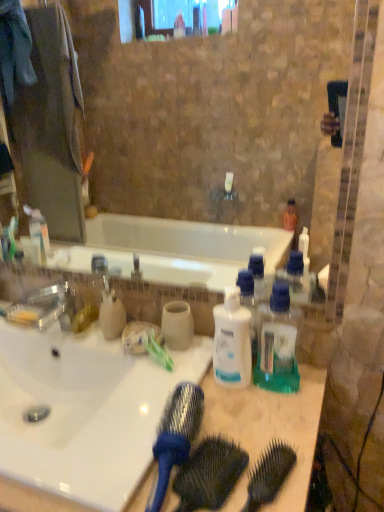
I want to click on vacant space in between blue plastic brush at center, which is the 2th brush in right-to-left order, and translucent green plastic at center, which appears as the 2th bottle when viewed from the left, so coord(244,411).